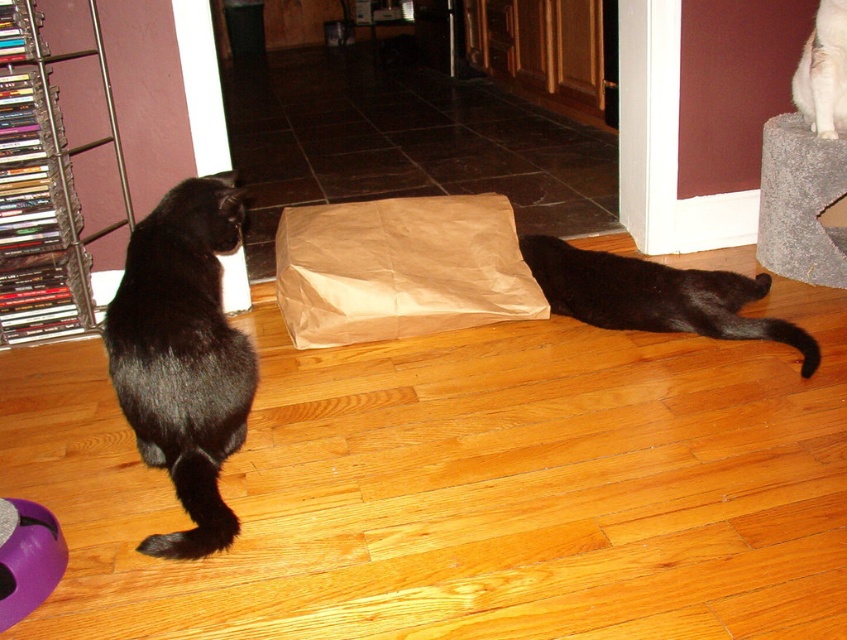
You are a photographer standing in the room and want to take a closeup photo of the black matte fur cat at lower right. The camera you are using has a minimum focusing distance of 5 feet. Can you take the photo without moving closer than 5 feet?

The black matte fur cat at lower right is 6.57 feet away from the camera. Since the minimum focusing distance is 5 feet, you can take the closeup photo without moving closer than 5 feet because the cat is within the camera range.

In the scene, there are a brown paper bag at center and a white fluffy cat at upper right. From the perspective of someone standing at the entrance of the room, which object is positioned to the left?

The brown paper bag at center is to the left of the white fluffy cat at upper right, so the brown paper bag at center is positioned to the left.

You are a cat owner who wants to place a new toy between the black fur cat at left and the black matte fur cat at lower right. Based on their positions, which cat will be closer to the toy once placed in the middle?

The black matte fur cat at lower right will be closer to the toy because the black fur cat at left is positioned on the left side of black matte fur cat at lower right, making the distance from the middle to the right cat shorter.